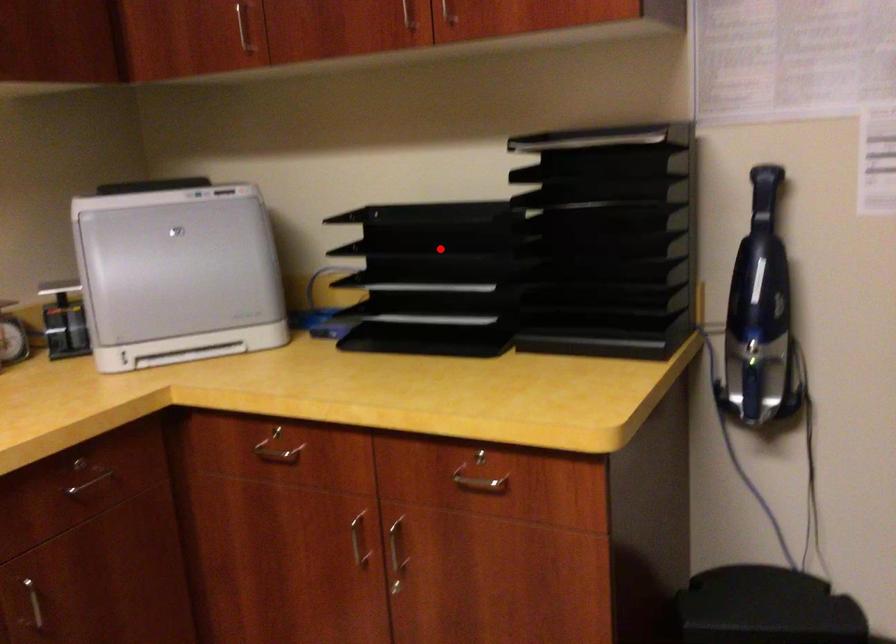
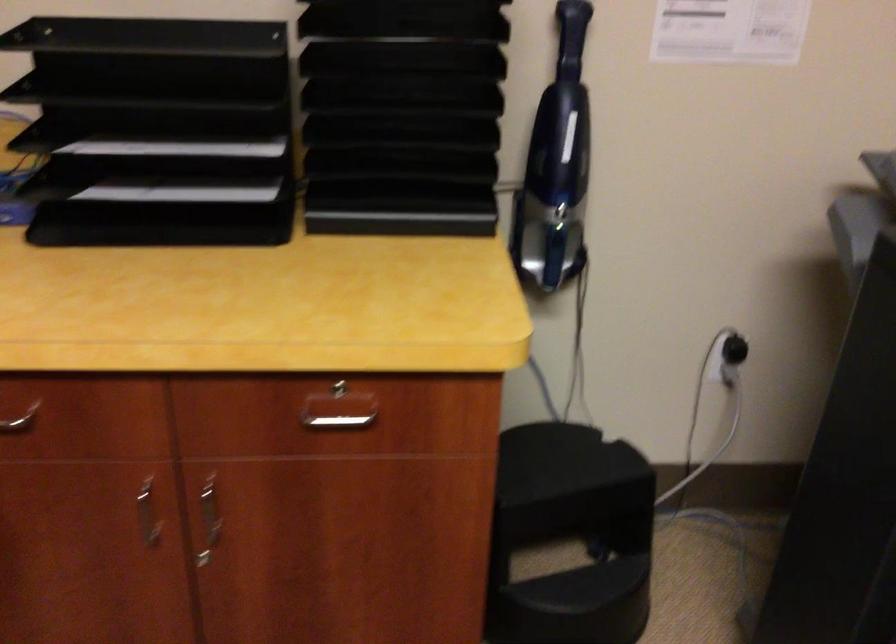
Question: I am providing you with two images of the same scene from different viewpoints. Image1 has a red point marked. In image2, the corresponding 3D location appears at what relative position? Reply with the corresponding letter.

Choices:
 (A) Closer
 (B) Farther

Answer: (A)